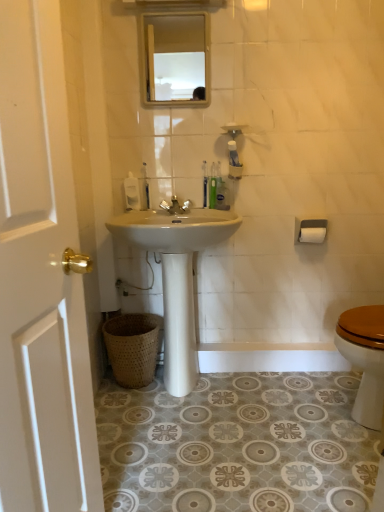
You are a GUI agent. You are given a task and a screenshot of the screen. Output one action in this format:
    pyautogui.click(x=<x>, y=<y>)
    Task: Click on the vacant space that is in between silver metallic faucet at center and translucent plastic toothbrush at center, which appears as the 1th toothbrush when viewed from the left
    The width and height of the screenshot is (384, 512).
    Given the screenshot: What is the action you would take?
    pyautogui.click(x=156, y=212)